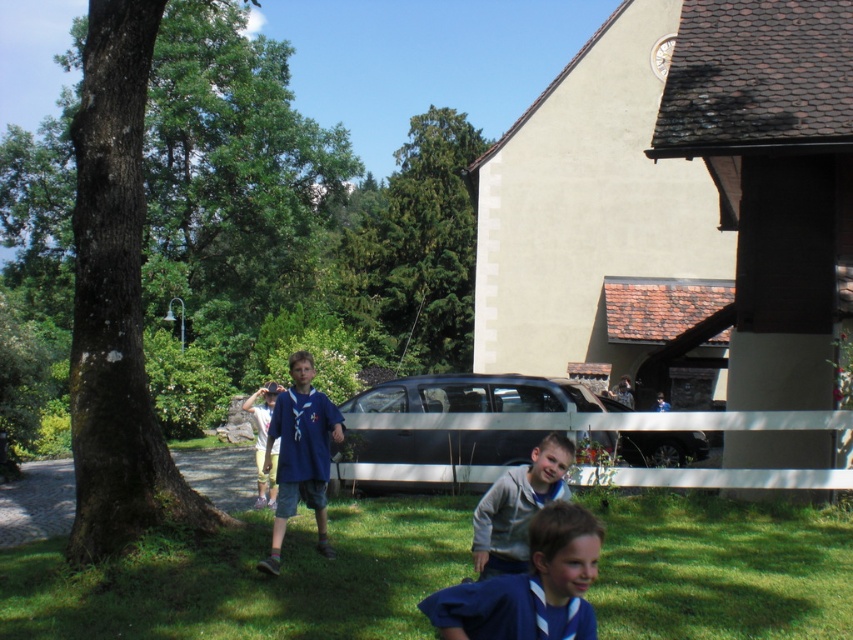
Question: Which object appears closest to the camera in this image?

Choices:
 (A) blue fabric shirt at lower center
 (B) blue cotton shirt at center
 (C) green grass at lower center

Answer: (A)

Question: Which of the following is the farthest from the observer?

Choices:
 (A) matte blue shirt at center
 (B) blue cotton shirt at center
 (C) green rough bark tree at left
 (D) silver metallic van at center

Answer: (D)

Question: In this image, where is green rough bark tree at left located relative to silver metallic van at center?

Choices:
 (A) above
 (B) below

Answer: (A)

Question: Does green rough bark tree at left appear over gray fleece jacket at lower center?

Choices:
 (A) yes
 (B) no

Answer: (A)

Question: In this image, where is gray fleece jacket at lower center located relative to blue cotton shirt at center?

Choices:
 (A) left
 (B) right

Answer: (B)

Question: Which object appears closest to the camera in this image?

Choices:
 (A) silver metallic van at center
 (B) matte blue shirt at center
 (C) gray fleece jacket at lower center

Answer: (C)